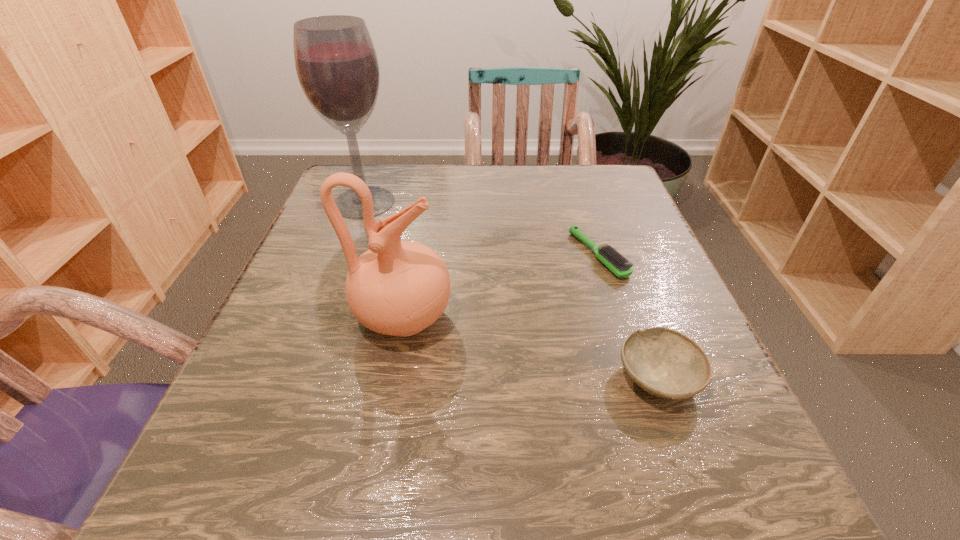
The width and height of the screenshot is (960, 540). What are the coordinates of `the tallest object` in the screenshot? It's located at (336, 63).

Identify the location of alcohol. (336, 63).

Find the location of `the second tallest object`. the second tallest object is located at coordinates (399, 288).

The image size is (960, 540). In order to click on bowl in this screenshot , I will do `click(664, 362)`.

What are the coordinates of `the shortest object` in the screenshot? It's located at (608, 256).

Find the location of a particular element. This screenshot has height=540, width=960. hairbrush is located at coordinates (608, 256).

Find the location of a particular element. The image size is (960, 540). blank space located 0.290m on the front of the alcohol is located at coordinates (322, 317).

Where is `free spot located 0.110m on the spout of the pottery`? The image size is (960, 540). free spot located 0.110m on the spout of the pottery is located at coordinates (517, 317).

I want to click on free region located 0.140m on the back of the third tallest object, so click(625, 287).

Identify the location of vacant region located on the left of the second farthest object. This screenshot has height=540, width=960. (412, 255).